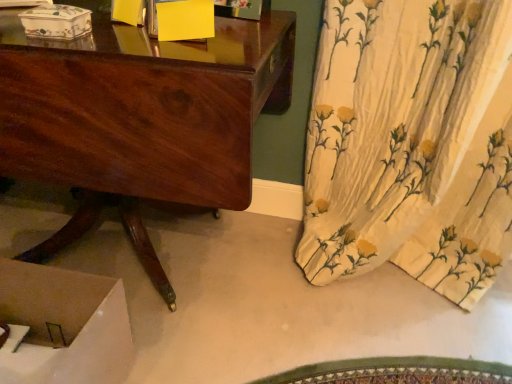
Question: From the image's perspective, is porcelain floral box at upper left, the first box positioned from the left, on yellow paper at upper center, placed as the 3th box when sorted from left to right?

Choices:
 (A) no
 (B) yes

Answer: (A)

Question: From a real-world perspective, is porcelain floral box at upper left, which appears as the third box when viewed from the right, physically above yellow paper at upper center, which is counted as the first box, starting from the right?

Choices:
 (A) no
 (B) yes

Answer: (A)

Question: Is porcelain floral box at upper left, which appears as the third box when viewed from the right, not near yellow paper at upper center, placed as the 3th box when sorted from left to right?

Choices:
 (A) no
 (B) yes

Answer: (A)

Question: Is porcelain floral box at upper left, the first box positioned from the left, at the left side of yellow paper at upper center, which is counted as the first box, starting from the right?

Choices:
 (A) no
 (B) yes

Answer: (B)

Question: Is porcelain floral box at upper left, the first box positioned from the left, wider than yellow paper at upper center, which is counted as the first box, starting from the right?

Choices:
 (A) no
 (B) yes

Answer: (B)

Question: Is shiny brown wood desk at center in front of or behind yellow paper at upper center, the second box from the left, in the image?

Choices:
 (A) front
 (B) behind

Answer: (A)

Question: Considering the positions of shiny brown wood desk at center and yellow paper at upper center, which appears as the second box when viewed from the right, in the image, is shiny brown wood desk at center taller or shorter than yellow paper at upper center, which appears as the second box when viewed from the right,?

Choices:
 (A) short
 (B) tall

Answer: (B)

Question: From a real-world perspective, is shiny brown wood desk at center positioned above or below yellow paper at upper center, which appears as the second box when viewed from the right?

Choices:
 (A) above
 (B) below

Answer: (B)

Question: Based on their sizes in the image, would you say shiny brown wood desk at center is bigger or smaller than yellow paper at upper center, the second box from the left?

Choices:
 (A) small
 (B) big

Answer: (B)

Question: From the image's perspective, is yellow paper at upper center, which is counted as the first box, starting from the right, above or below shiny brown wood desk at center?

Choices:
 (A) below
 (B) above

Answer: (B)

Question: From a real-world perspective, is yellow paper at upper center, placed as the 3th box when sorted from left to right, above or below shiny brown wood desk at center?

Choices:
 (A) below
 (B) above

Answer: (B)

Question: Considering their positions, is yellow paper at upper center, which is counted as the first box, starting from the right, located in front of or behind shiny brown wood desk at center?

Choices:
 (A) front
 (B) behind

Answer: (B)

Question: Is yellow paper at upper center, which is counted as the first box, starting from the right, wider or thinner than shiny brown wood desk at center?

Choices:
 (A) wide
 (B) thin

Answer: (B)

Question: In terms of width, does porcelain floral box at upper left, which appears as the third box when viewed from the right, look wider or thinner when compared to yellow paper at upper center, the second box from the left?

Choices:
 (A) thin
 (B) wide

Answer: (B)

Question: Is porcelain floral box at upper left, which appears as the third box when viewed from the right, in front of or behind yellow paper at upper center, the second box from the left, in the image?

Choices:
 (A) behind
 (B) front

Answer: (B)